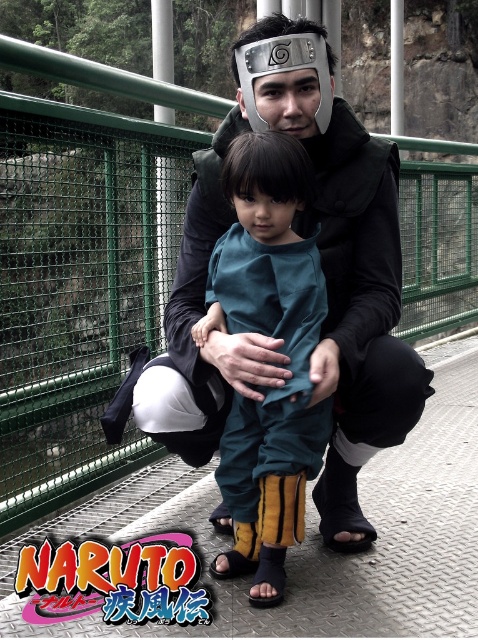
You are a costume designer trying to create a replica of the outfits seen in the image. You need to decide which object from the scene requires more horizontal space when laying it out on a table. Which one is wider between the teal fabric pants at center and the metallic silver headband at center?

The teal fabric pants at center is wider than the metallic silver headband at center, so the teal fabric pants at center would require more horizontal space when laying out on a table.